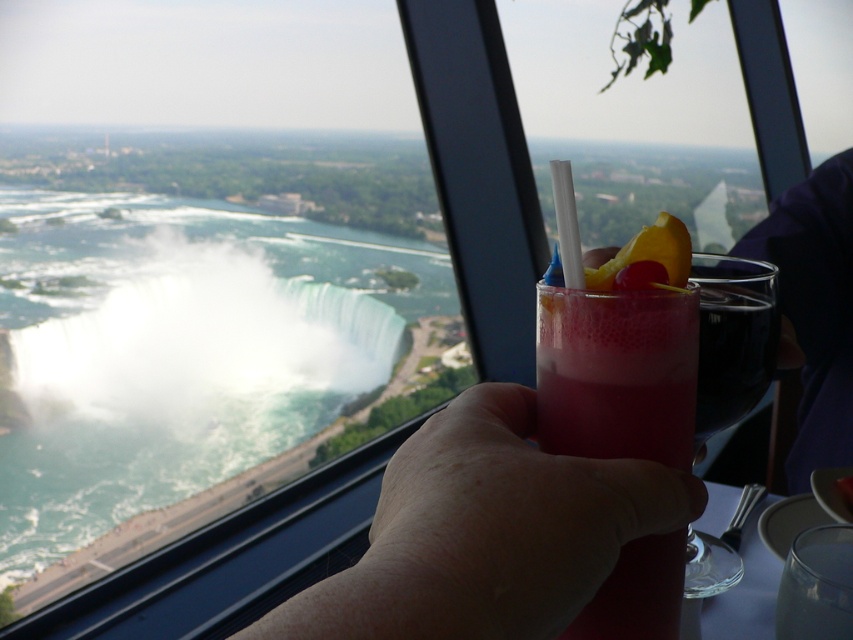
You are a photographer trying to capture both the pink translucent glass at center and the yellow rubber ring at center in your shot. Based on their positions, which object should you adjust first to ensure both are centered in your frame?

The pink translucent glass at center is to the left of the yellow rubber ring at center, so you should adjust the pink translucent glass at center first to move it to the right to align both objects in the center of the frame.

You are a bartender preparing a drink for a customer who wants a drink that can be easily seen from across the room. The customer is seated at a table with a yellow rubber ring at center. You have a pink translucent glass at center. Which glass should you use to ensure the drink is more visible?

The pink translucent glass at center is much taller than the yellow rubber ring at center, making it more visible from a distance.